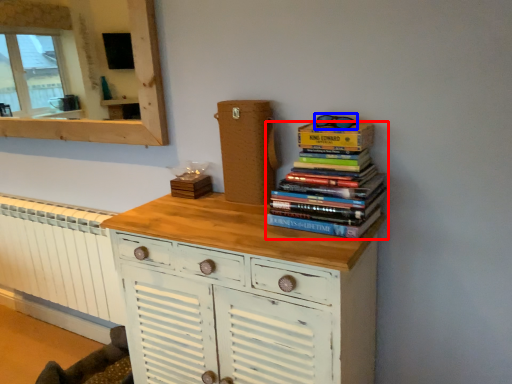
Question: Which object appears farthest to the camera in this image, book (highlighted by a red box) or goggles (highlighted by a blue box)?

Choices:
 (A) book
 (B) goggles

Answer: (B)